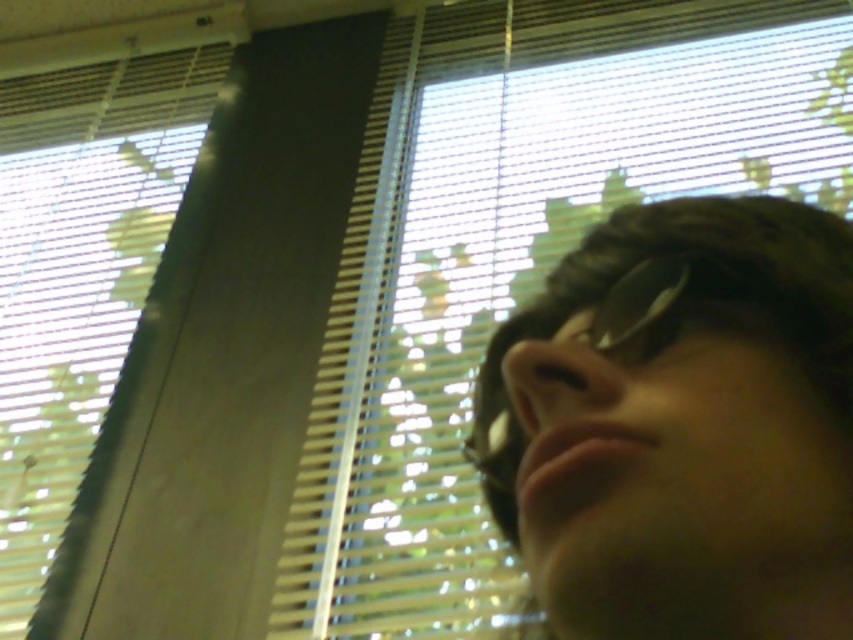
You are designing a poster and need to know the relative sizes of the objects in the image. Based on the scene, which object is shorter, the matte black sunglasses at right or the white plastic blinds at upper left?

The matte black sunglasses at right is shorter than the white plastic blinds at upper left.

You are a photographer trying to capture the reflection of the white plastic blinds at upper left in the sunglasses at center. Can you see the blinds reflected in the sunglasses?

The white plastic blinds at upper left is further to the viewer than sunglasses at center, so the sunglasses at center are closer to the photographer. Since the blinds are behind the sunglasses, their reflection would not be visible in the sunglasses.

You are an interior designer trying to install a new decorative item between the white plastic blinds at upper center and the white plastic blinds at upper left. The item requires a minimum of 20 inches of space. Can you fit it there?

The distance between the white plastic blinds at upper center and the white plastic blinds at upper left is 22.31 inches, which is more than the required 20 inches. Therefore, the decorative item can be installed there.